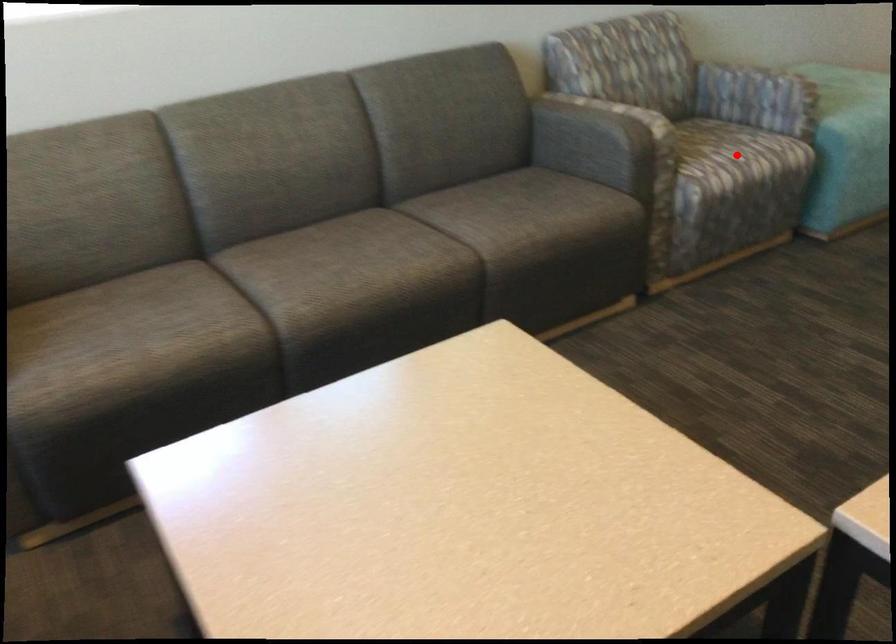
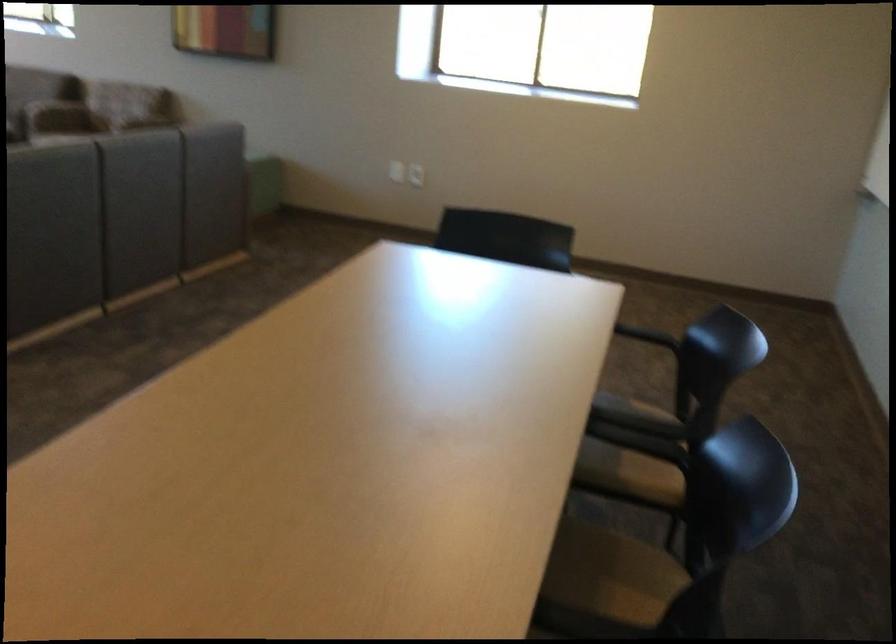
Question: I am providing you with two images of the same scene from different viewpoints. A red point is marked on the first image. Can you still see the location of the red point in image 2?

Choices:
 (A) Yes
 (B) No

Answer: (B)